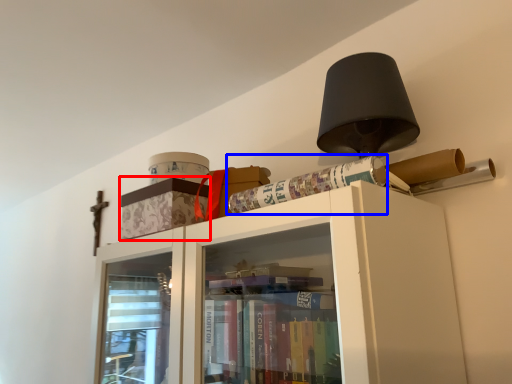
Question: Which point is further to the camera, cabinetry (highlighted by a red box) or paperback book (highlighted by a blue box)?

Choices:
 (A) cabinetry
 (B) paperback book

Answer: (A)